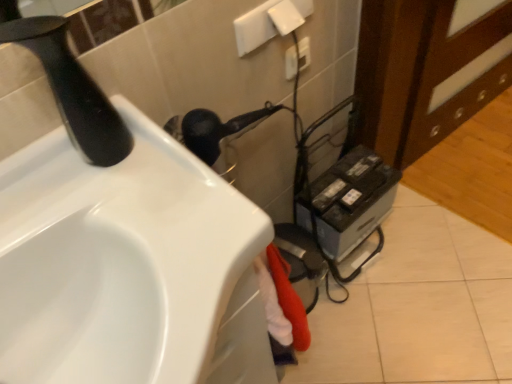
What is the approximate height of black matte faucet at upper left?

9.88 inches.

The height and width of the screenshot is (384, 512). Find the location of `metallic gray printer at lower right`. metallic gray printer at lower right is located at coordinates (348, 201).

Find the location of `white plastic electric outlet at upper center`. white plastic electric outlet at upper center is located at coordinates (297, 58).

Which object is wider, metallic gray printer at lower right or white glossy sink at lower left?

white glossy sink at lower left.

In terms of height, does metallic gray printer at lower right look taller or shorter compared to white glossy sink at lower left?

In the image, metallic gray printer at lower right appears to be shorter than white glossy sink at lower left.

Does metallic gray printer at lower right contain white glossy sink at lower left?

No.

The image size is (512, 384). In order to click on appliance on the right of black matte faucet at upper left in this screenshot , I will do `click(348, 201)`.

Would you say metallic gray printer at lower right is outside black matte faucet at upper left?

metallic gray printer at lower right is positioned outside black matte faucet at upper left.

From a real-world perspective, is metallic gray printer at lower right positioned over black matte faucet at upper left based on gravity?

Incorrect, from a real-world perspective, metallic gray printer at lower right is lower than black matte faucet at upper left.

From the image's perspective, which is below, metallic gray printer at lower right or black matte faucet at upper left?

metallic gray printer at lower right appears lower in the image.

Between black matte faucet at upper left and white plastic electric outlet at upper center, which one has larger size?

black matte faucet at upper left is bigger.

Is black matte faucet at upper left placed right next to white plastic electric outlet at upper center?

black matte faucet at upper left and white plastic electric outlet at upper center are clearly separated.

The width and height of the screenshot is (512, 384). What are the coordinates of `tap above the white plastic electric outlet at upper center (from a real-world perspective)` in the screenshot? It's located at (73, 91).

Looking at this image, does black matte faucet at upper left have a lesser height compared to white plastic electric outlet at upper center?

No.

Between white plastic electric outlet at upper center and black matte faucet at upper left, which one has smaller width?

white plastic electric outlet at upper center.

The image size is (512, 384). Find the location of `electric outlet behind the black matte faucet at upper left`. electric outlet behind the black matte faucet at upper left is located at coordinates (297, 58).

From a real-world perspective, which is physically below, white plastic electric outlet at upper center or black matte faucet at upper left?

From a 3D spatial view, white plastic electric outlet at upper center is below.

Based on the photo, is the position of black matte faucet at upper left more distant than that of white glossy sink at lower left?

Yes, black matte faucet at upper left is further from the viewer.

Considering the positions of objects black matte faucet at upper left and white glossy sink at lower left in the image provided, who is more to the left, black matte faucet at upper left or white glossy sink at lower left?

Positioned to the left is black matte faucet at upper left.

Does black matte faucet at upper left have a smaller size compared to white glossy sink at lower left?

Correct, black matte faucet at upper left occupies less space than white glossy sink at lower left.

Is white glossy sink at lower left a part of black matte faucet at upper left?

No, white glossy sink at lower left is not inside black matte faucet at upper left.

Which point is more forward, [319,178] or [290,77]?

Point [290,77]

Does metallic gray printer at lower right have a lesser height compared to white plastic electric outlet at upper center?

No.

Find the location of a particular element. The width and height of the screenshot is (512, 384). appliance that appears behind the white plastic electric outlet at upper center is located at coordinates (348, 201).

Which is in front, metallic gray printer at lower right or white plastic electric outlet at upper center?

white plastic electric outlet at upper center is closer to the camera.

Between white plastic electric outlet at upper center and white glossy sink at lower left, which one has smaller size?

Smaller between the two is white plastic electric outlet at upper center.

Is white plastic electric outlet at upper center not near white glossy sink at lower left?

Actually, white plastic electric outlet at upper center and white glossy sink at lower left are a little close together.

Is white plastic electric outlet at upper center further to the viewer compared to white glossy sink at lower left?

Yes, white plastic electric outlet at upper center is behind white glossy sink at lower left.

The image size is (512, 384). I want to click on sink on the left of white plastic electric outlet at upper center, so click(128, 267).

Find the location of a particular element. appliance located underneath the white glossy sink at lower left (from a real-world perspective) is located at coordinates (348, 201).

The height and width of the screenshot is (384, 512). Find the location of `appliance lying behind the black matte faucet at upper left`. appliance lying behind the black matte faucet at upper left is located at coordinates (348, 201).

Which object lies further to the anchor point white plastic electric outlet at upper center, white glossy sink at lower left or metallic gray printer at lower right?

white glossy sink at lower left is further to white plastic electric outlet at upper center.

Looking at the image, which one is located closer to black matte faucet at upper left, metallic gray printer at lower right or white plastic electric outlet at upper center?

Among the two, white plastic electric outlet at upper center is located nearer to black matte faucet at upper left.

Consider the image. Looking at the image, which one is located closer to white plastic electric outlet at upper center, white glossy sink at lower left or black matte faucet at upper left?

black matte faucet at upper left is closer to white plastic electric outlet at upper center.

When comparing their distances from metallic gray printer at lower right, does black matte faucet at upper left or white plastic electric outlet at upper center seem closer?

Among the two, white plastic electric outlet at upper center is located nearer to metallic gray printer at lower right.

When comparing their distances from white glossy sink at lower left, does black matte faucet at upper left or white plastic electric outlet at upper center seem further?

white plastic electric outlet at upper center.

Considering their positions, is white plastic electric outlet at upper center positioned closer to white glossy sink at lower left than black matte faucet at upper left?

black matte faucet at upper left is closer to white glossy sink at lower left.

Looking at the image, which one is located further to black matte faucet at upper left, white plastic electric outlet at upper center or metallic gray printer at lower right?

metallic gray printer at lower right.

From the image, which object appears to be nearer to metallic gray printer at lower right, white glossy sink at lower left or black matte faucet at upper left?

white glossy sink at lower left is positioned closer to the anchor metallic gray printer at lower right.

Where is `tap between white plastic electric outlet at upper center and white glossy sink at lower left in the vertical direction`? The height and width of the screenshot is (384, 512). tap between white plastic electric outlet at upper center and white glossy sink at lower left in the vertical direction is located at coordinates (73, 91).

Where is `electric outlet between white glossy sink at lower left and metallic gray printer at lower right along the z-axis`? electric outlet between white glossy sink at lower left and metallic gray printer at lower right along the z-axis is located at coordinates (297, 58).

You are a GUI agent. You are given a task and a screenshot of the screen. Output one action in this format:
    pyautogui.click(x=<x>, y=<y>)
    Task: Click on the electric outlet located between black matte faucet at upper left and metallic gray printer at lower right in the depth direction
    Image resolution: width=512 pixels, height=384 pixels.
    Given the screenshot: What is the action you would take?
    pyautogui.click(x=297, y=58)

The image size is (512, 384). In order to click on tap positioned between white glossy sink at lower left and metallic gray printer at lower right from near to far in this screenshot , I will do `click(73, 91)`.